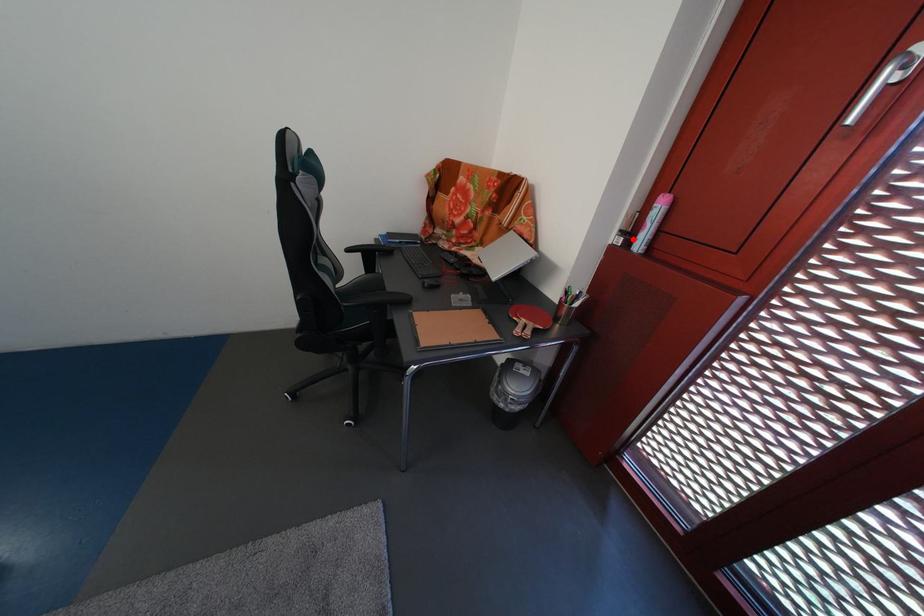
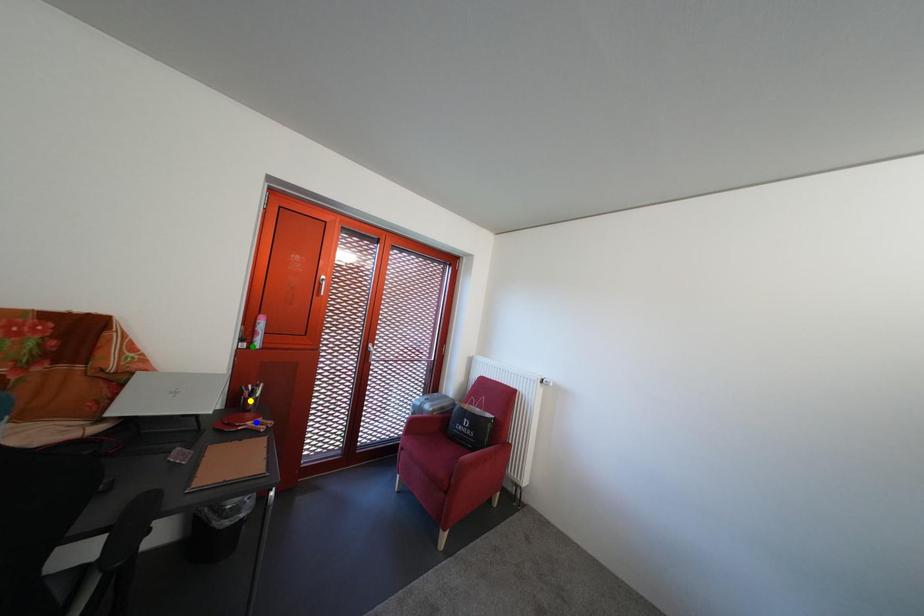
Question: I am providing you with two images of the same scene from different viewpoints. A red point is marked on the first image. You are given multiple points on the second image. Can you choose the point in image 2 that corresponds to the point in image 1?

Choices:
 (A) green point
 (B) yellow point
 (C) blue point

Answer: (A)